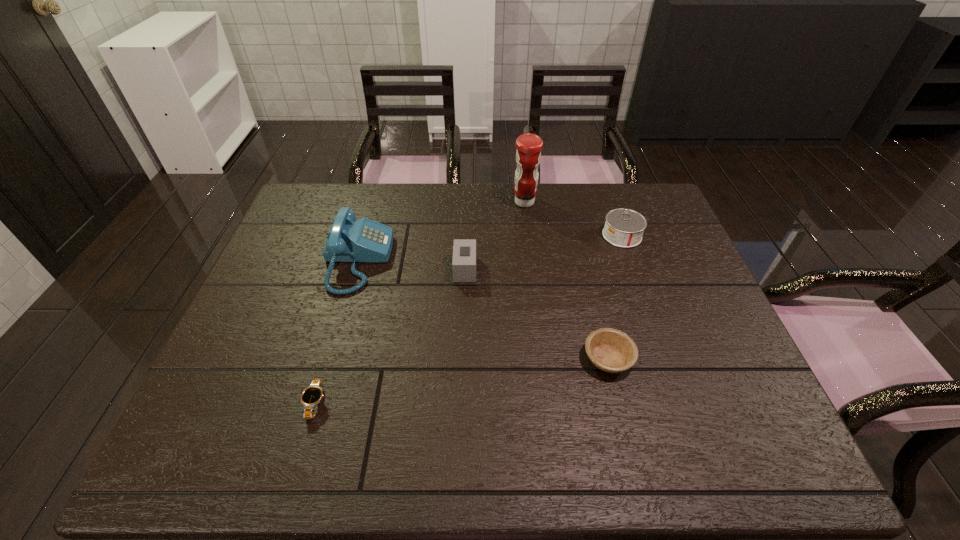
This screenshot has height=540, width=960. I want to click on vacant space at the far edge of the desktop, so click(x=401, y=225).

This screenshot has height=540, width=960. I want to click on vacant region at the near edge, so click(472, 458).

The width and height of the screenshot is (960, 540). Find the location of `vacant space at the left edge`. vacant space at the left edge is located at coordinates tap(245, 318).

Where is `vacant space at the right edge`? The image size is (960, 540). vacant space at the right edge is located at coordinates (683, 333).

At what (x,y) coordinates should I click in order to perform the action: click on blank area at the far left corner. Please return your answer as a coordinate pair (x, y). The image size is (960, 540). Looking at the image, I should click on (295, 208).

Locate an element on the screen. Image resolution: width=960 pixels, height=540 pixels. vacant region at the near left corner is located at coordinates (224, 441).

I want to click on free space at the far right corner of the desktop, so click(x=641, y=200).

Where is `blank region between the condiment and the shortest object`? The image size is (960, 540). blank region between the condiment and the shortest object is located at coordinates (420, 302).

Identify the location of vacant point located between the fourth object from right to left and the fifth tallest object. (537, 314).

Where is `vacant region between the shortest object and the third object from left to right`? Image resolution: width=960 pixels, height=540 pixels. vacant region between the shortest object and the third object from left to right is located at coordinates (391, 336).